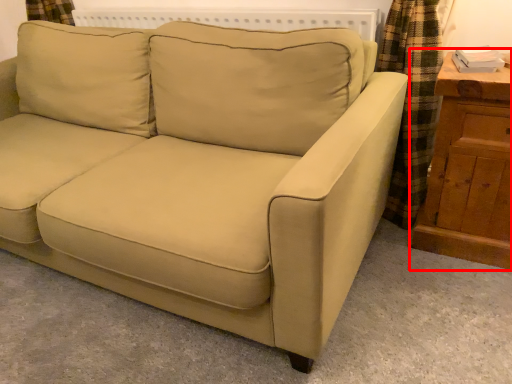
Question: From the image, what is the correct spatial relationship of dresser (annotated by the red box) in relation to studio couch?

Choices:
 (A) right
 (B) left

Answer: (A)